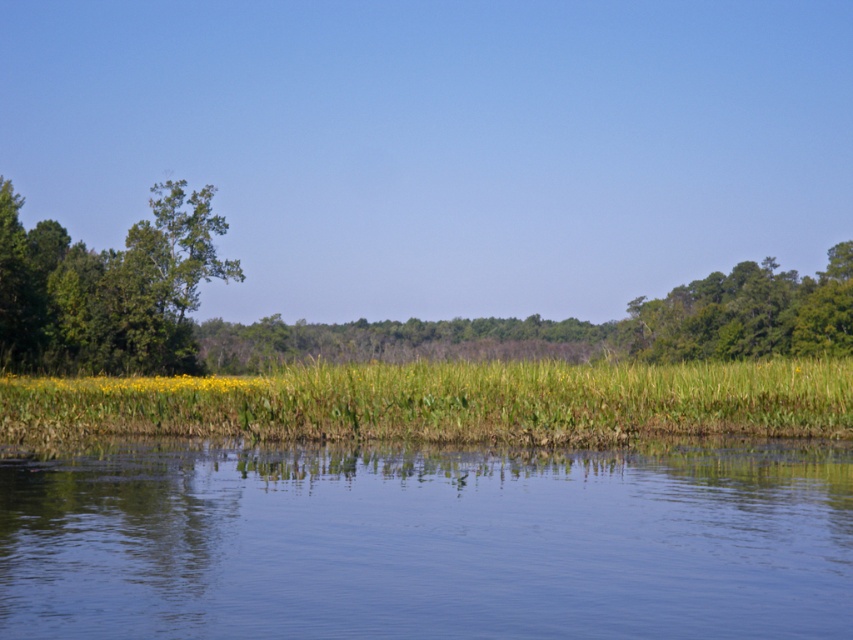
Question: Which point is closer to the camera?

Choices:
 (A) transparent water at center
 (B) green grass at center
 (C) green leafy trees at upper right
 (D) green leafy tree at left

Answer: (A)

Question: Does green grass at center have a larger size compared to green leafy tree at left?

Choices:
 (A) yes
 (B) no

Answer: (B)

Question: Is the position of transparent water at center less distant than that of green grass at center?

Choices:
 (A) yes
 (B) no

Answer: (A)

Question: Which point appears farthest from the camera in this image?

Choices:
 (A) (263, 563)
 (B) (846, 268)
 (C) (15, 216)

Answer: (B)

Question: Is transparent water at center below green leafy tree at left?

Choices:
 (A) yes
 (B) no

Answer: (A)

Question: Which object is the farthest from the green leafy tree at left?

Choices:
 (A) green leafy trees at upper right
 (B) green grass at center
 (C) transparent water at center

Answer: (A)